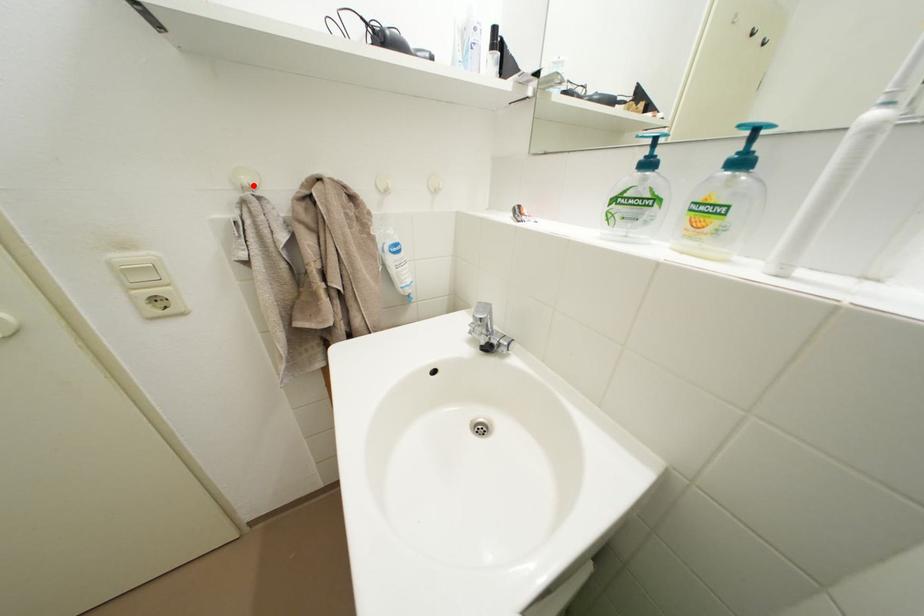
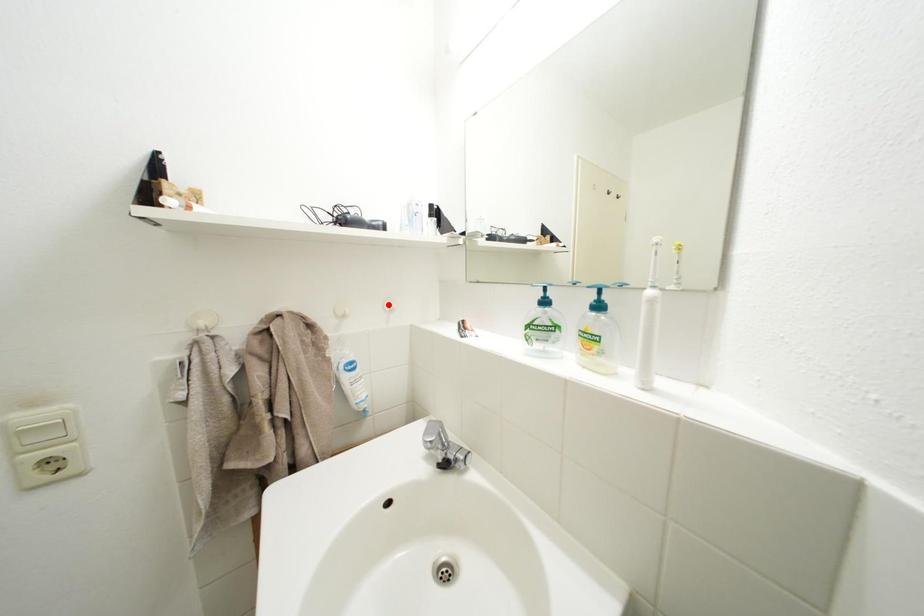
I am providing you with two images of the same scene from different viewpoints. A red point is marked on the first image and another point is marked on the second image. Does the point marked in image1 correspond to the same location as the one in image2?

No